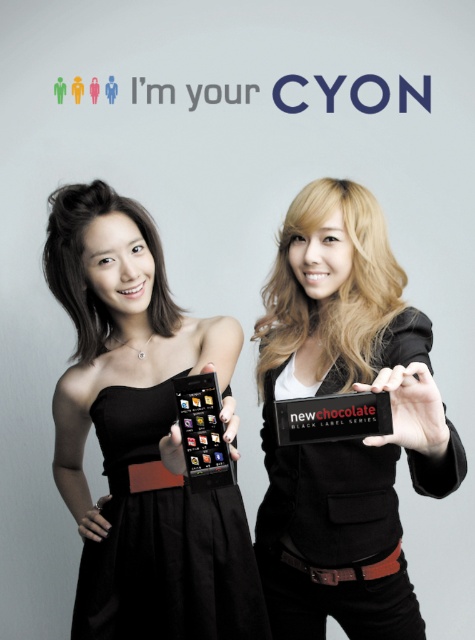
Question: In this image, where is matte black card at right located relative to black satin dress at center?

Choices:
 (A) below
 (B) above

Answer: (B)

Question: Which of the following is the closest to the observer?

Choices:
 (A) matte black dress at center
 (B) black satin dress at center
 (C) matte black phone at left
 (D) matte black card at right

Answer: (D)

Question: Which point appears farthest from the camera in this image?

Choices:
 (A) (355, 257)
 (B) (174, 310)
 (C) (180, 620)

Answer: (B)

Question: Where is black satin dress at center located in relation to matte black dress at center in the image?

Choices:
 (A) below
 (B) above

Answer: (A)

Question: Is matte black phone at left below matte black dress at center?

Choices:
 (A) no
 (B) yes

Answer: (B)

Question: Based on their relative distances, which object is nearer to the matte black phone at left?

Choices:
 (A) matte black dress at center
 (B) matte black card at right
 (C) black satin dress at center

Answer: (B)